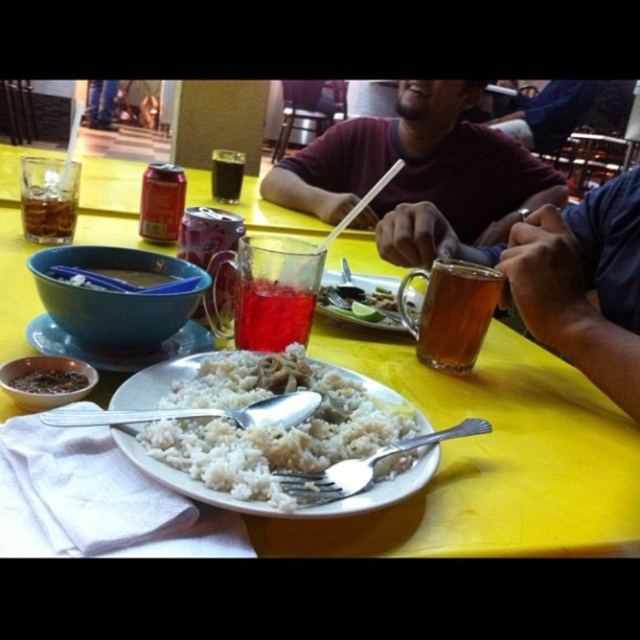
Question: Which point is closer to the camera taking this photo?

Choices:
 (A) (220, 492)
 (B) (243, 314)
 (C) (497, 282)
 (D) (227, 188)

Answer: (A)

Question: Which object appears farthest from the camera in this image?

Choices:
 (A) slightly translucent glass at center
 (B) brown crumbly food at center
 (C) maroon t-shirt at center

Answer: (C)

Question: Does slightly translucent glass at center have a greater width compared to translucent glass cup at upper left?

Choices:
 (A) yes
 (B) no

Answer: (A)

Question: Considering the real-world distances, which object is farthest from the translucent glass at center?

Choices:
 (A) dark brown liquid at center
 (B) translucent glass cup at upper left
 (C) slightly translucent glass at center

Answer: (A)

Question: Can you confirm if yellow plastic table at center is thinner than slightly translucent glass at center?

Choices:
 (A) yes
 (B) no

Answer: (B)

Question: Is translucent glass mug at center in front of brown crumbly food at center?

Choices:
 (A) yes
 (B) no

Answer: (B)